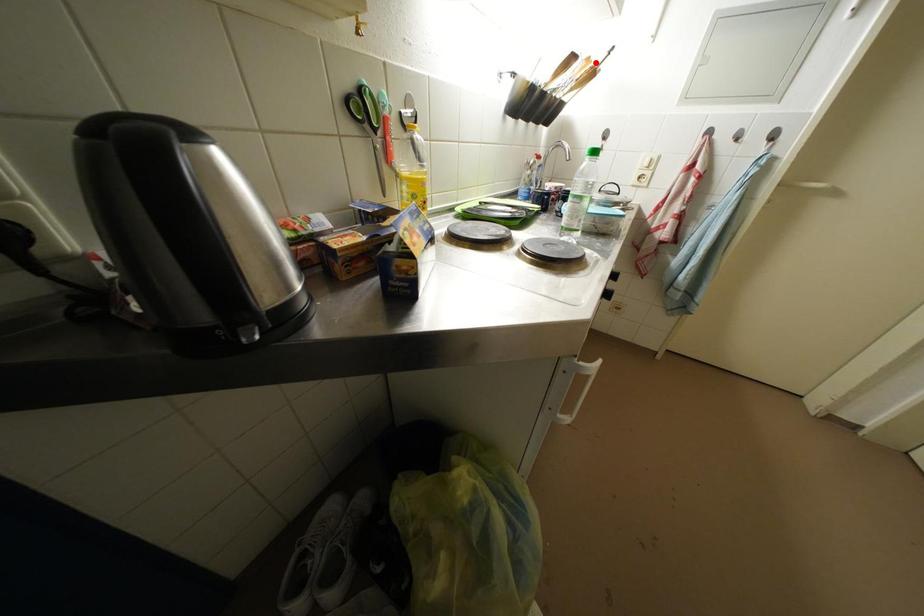
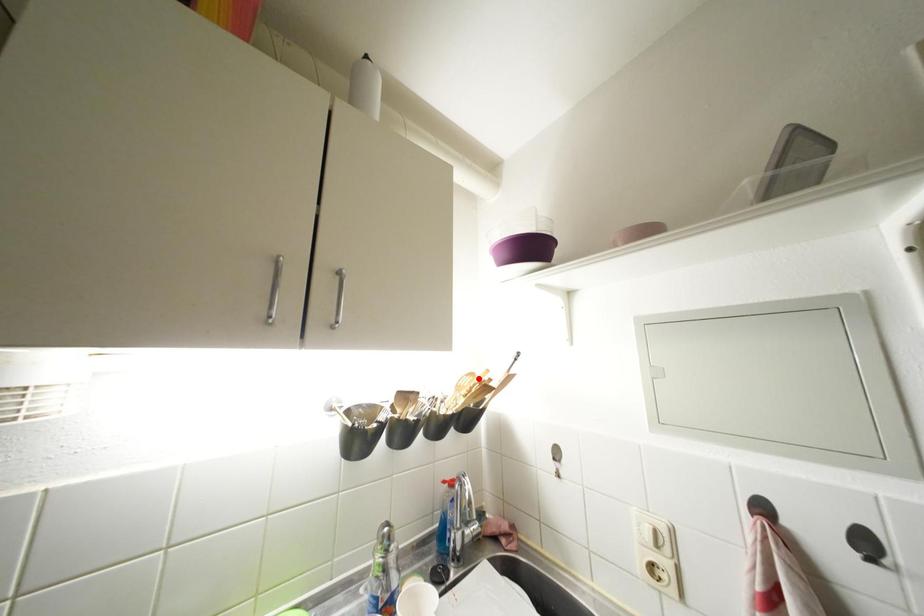
I am providing you with two images of the same scene from different viewpoints. A red point is marked on the first image and another point is marked on the second image. Does the point marked in image1 correspond to the same location as the one in image2?

Yes